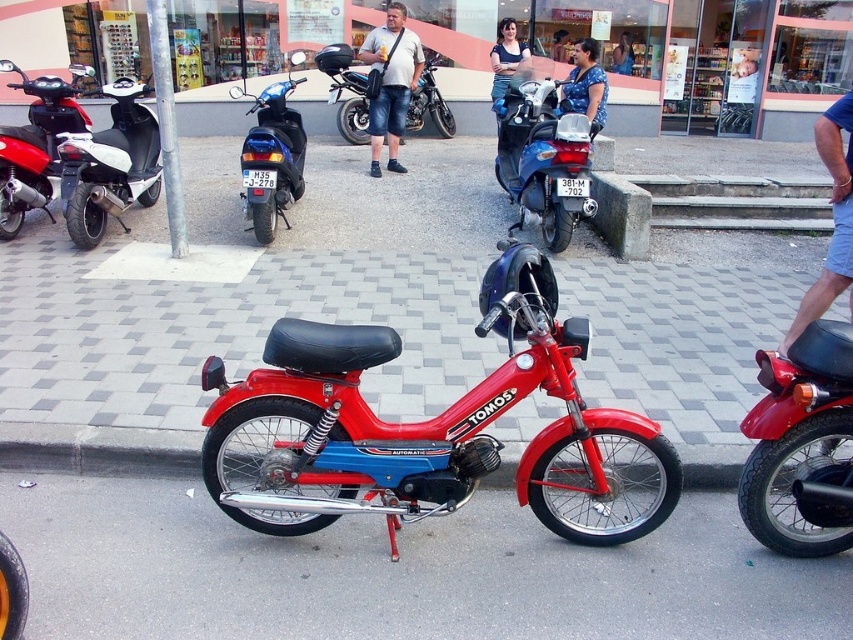
Question: Which point is closer to the camera?

Choices:
 (A) shiny red motorcycle at center
 (B) blue denim shorts at right
 (C) blue denim shirt at center
 (D) blue glossy scooter at center

Answer: (A)

Question: Is blue denim shorts at right further to camera compared to matte black shirt at center?

Choices:
 (A) yes
 (B) no

Answer: (B)

Question: In this image, where is shiny red motorcycle at center located relative to metallic blue moped at center?

Choices:
 (A) above
 (B) below

Answer: (B)

Question: Which object is closer to the camera taking this photo?

Choices:
 (A) matte red moped at left
 (B) matte black shorts at center
 (C) blue denim shirt at center
 (D) metallic blue scooter at center

Answer: (A)

Question: Observing the image, what is the correct spatial positioning of matte black shirt at center in reference to blue denim shirt at center?

Choices:
 (A) below
 (B) above

Answer: (A)

Question: Among these objects, which one is farthest from the camera?

Choices:
 (A) matte black shorts at center
 (B) blue denim shirt at center
 (C) blue dotted dress at center
 (D) metallic blue scooter at center

Answer: (B)